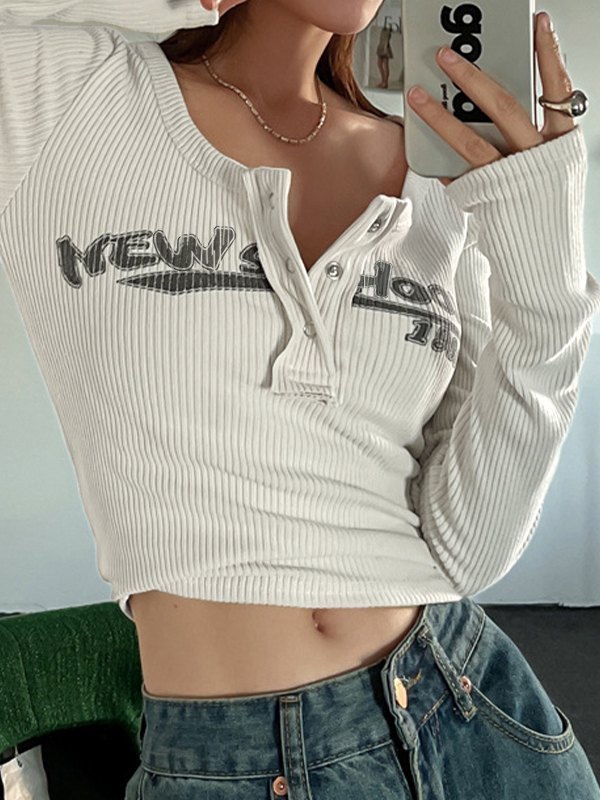
At what (x,y) coordinates should I click in order to perform the action: click on couch. Please return your answer as a coordinate pair (x, y). Looking at the image, I should click on (68, 686), (565, 653).